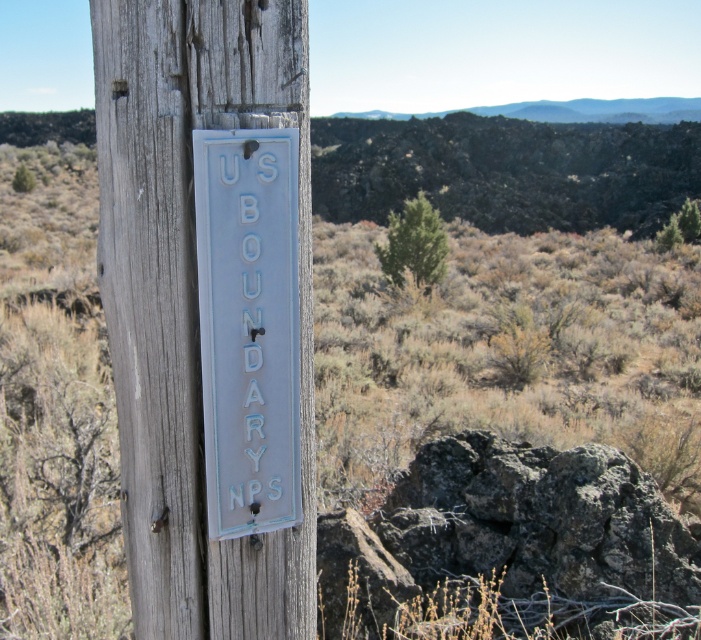
You are standing in front of the boundary marker and want to touch both signs. Which sign should you reach for first, the white painted wood sign at center or the white painted metal sign at center?

You should reach for the white painted wood sign at center first because it is closer to you than the white painted metal sign at center.

You are a hiker in the desert and see two signs ahead. One is the white painted wood sign at center and the other is the white painted metal sign at center. Which one is positioned to the left when facing the signs?

The white painted wood sign at center is positioned to the left of the white painted metal sign at center when facing the signs.

You are standing in front of a U.S. Boundary NPS sign attached to a weathered wooden post in a desert landscape. There is a point at coordinates point (193,316). Can you determine if this point is within arm reach from your current position?

The point (193,316) is 1.03 meters from viewer, so yes, it is within arm reach since the average arm length is about 0.7 meters, but the distance here is slightly longer. However, it might still be reachable by stretching.